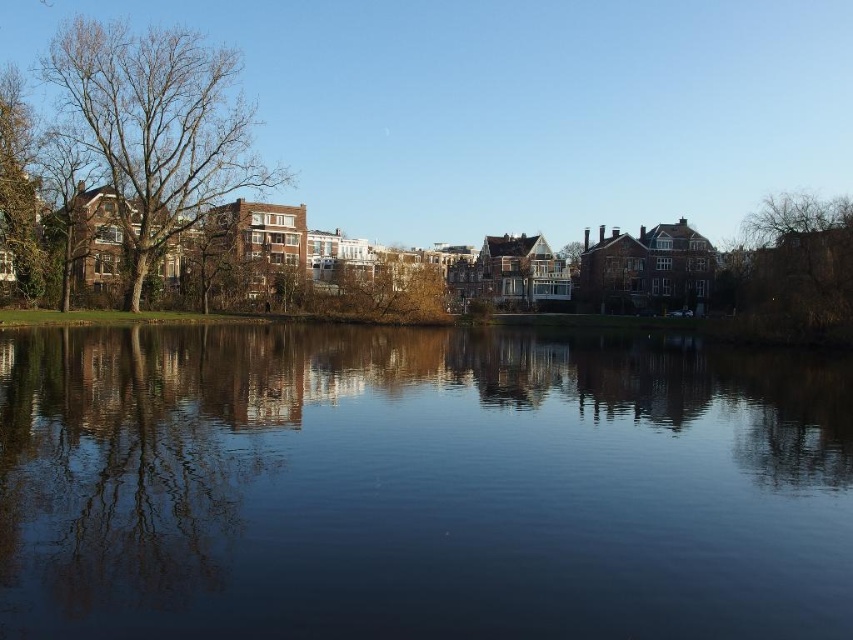
You are an artist planning to paint the scene. You want to emphasize the contrast between the two groups of bare branches at left and bare branches at right. Which one should you make larger in your painting to achieve this effect?

To emphasize the contrast between the two groups of bare branches, you should make the bare branches at left larger in your painting since they are naturally larger compared to the bare branches at right.

You are a bird flying over the urban landscape. You want to land on a tree. The bare branches at left and the brown wood tree at center are both options. Which tree is closer to your current position if you are directly above the water surface between them?

The brown wood tree at center is closer to your current position because it is only 290.15 feet away from the bare branches at left, so if you are between them, the distance to each would depend on your exact location. However, since the question states you are directly above the water between them, the exact midpoint would be 145.075 feet from each. But since the question asks which is closer without specifying the exact midpoint, perhaps there is an error in the question setup. Alternatively, if the total